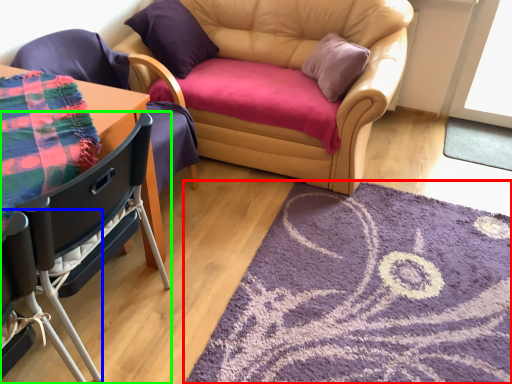
Question: Estimate the real-world distances between objects in this image. Which object is farther from mat (highlighted by a red box), chair (highlighted by a blue box) or chair (highlighted by a green box)?

Choices:
 (A) chair
 (B) chair

Answer: (A)